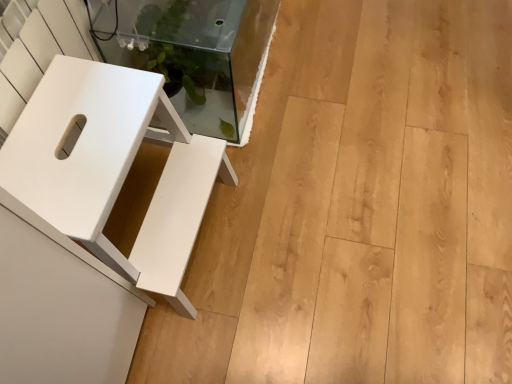
The height and width of the screenshot is (384, 512). I want to click on vacant space in front of transparent glass table at upper left, so click(291, 180).